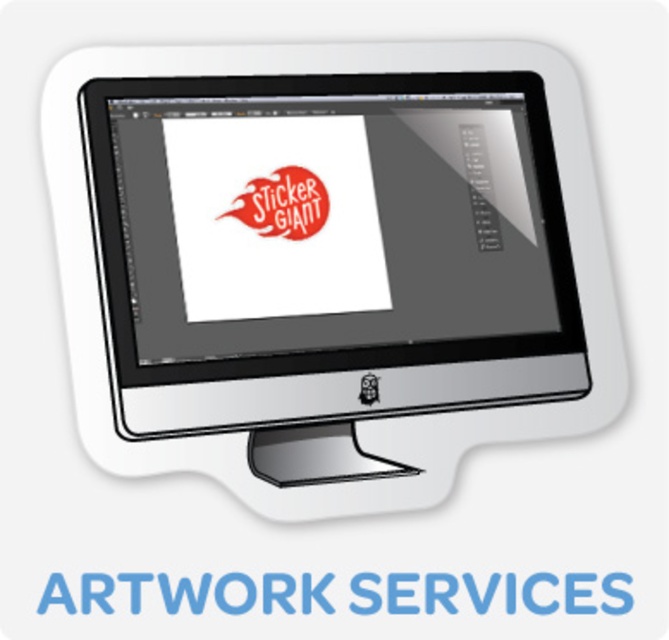
Does point (403, 600) come farther from viewer compared to point (244, 211)?

No, it is in front of (244, 211).

From the picture: Is white matte sticker at center positioned in front of flame red sticker at center?

Yes, it is in front of flame red sticker at center.

I want to click on white matte sticker at center, so click(488, 593).

Can you confirm if white glossy desktop computer at center is positioned to the left of white matte sticker at center?

Incorrect, white glossy desktop computer at center is not on the left side of white matte sticker at center.

Is white glossy desktop computer at center shorter than white matte sticker at center?

In fact, white glossy desktop computer at center may be taller than white matte sticker at center.

Between point (357, 381) and point (626, 609), which one is positioned in front?

Point (626, 609) is more forward.

Locate an element on the screen. The image size is (669, 640). white glossy desktop computer at center is located at coordinates (328, 260).

Does white glossy desktop computer at center appear over flame red sticker at center?

Incorrect, white glossy desktop computer at center is not positioned above flame red sticker at center.

Who is higher up, white glossy desktop computer at center or flame red sticker at center?

flame red sticker at center

Who is more distant from viewer, (x=132, y=81) or (x=256, y=209)?

The point (x=256, y=209) is more distant.

Locate an element on the screen. white glossy desktop computer at center is located at coordinates (328, 260).